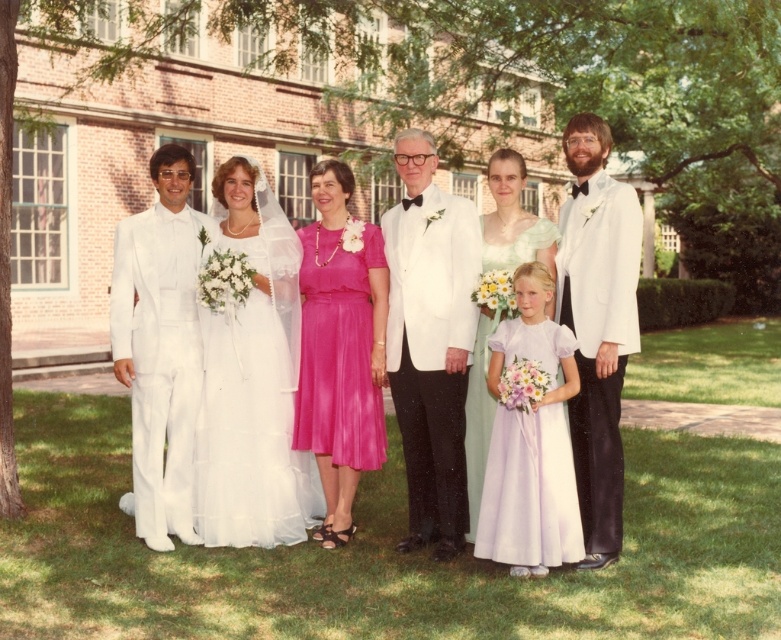
Between point (569, 268) and point (478, 480), which one is positioned behind?

Positioned behind is point (478, 480).

Which is above, white satin tuxedo at right or light green satin dress at center?

light green satin dress at center is higher up.

The width and height of the screenshot is (781, 640). What are the coordinates of `white satin tuxedo at right` in the screenshot? It's located at tap(597, 324).

Is white satin tuxedo at center to the right of white satin tuxedo at right from the viewer's perspective?

Incorrect, white satin tuxedo at center is not on the right side of white satin tuxedo at right.

This screenshot has width=781, height=640. Find the location of `white satin tuxedo at center`. white satin tuxedo at center is located at coordinates pos(430,340).

This screenshot has width=781, height=640. I want to click on white satin tuxedo at center, so point(430,340).

The height and width of the screenshot is (640, 781). In order to click on white satin tuxedo at center in this screenshot , I will do `click(430, 340)`.

Which is behind, point (451, 365) or point (490, 525)?

The point (451, 365) is more distant.

Describe the element at coordinates (430, 340) in the screenshot. I see `white satin tuxedo at center` at that location.

Identify the location of white satin tuxedo at center. Image resolution: width=781 pixels, height=640 pixels. (430, 340).